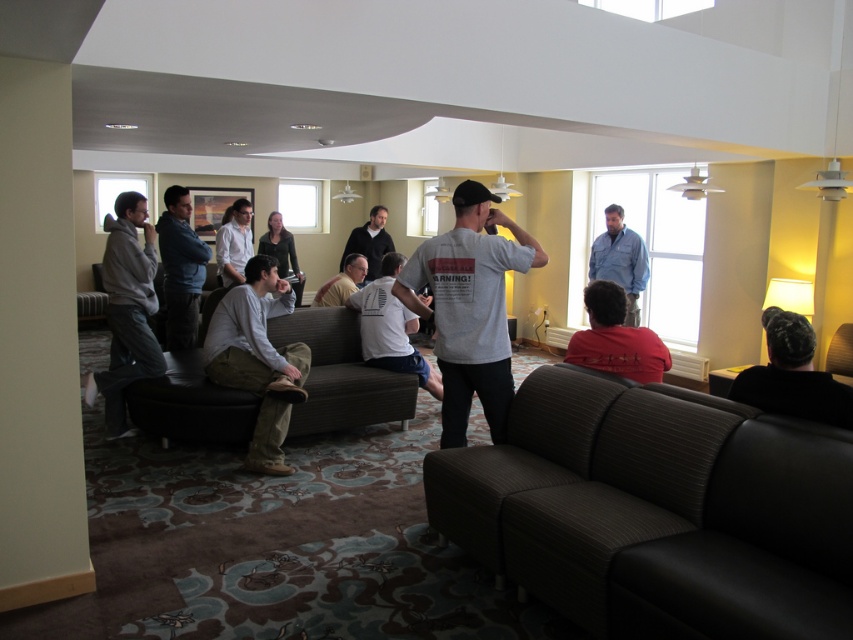
Question: Among these points, which one is nearest to the camera?

Choices:
 (A) tap(438, 236)
 (B) tap(282, 259)
 (C) tap(663, 346)

Answer: (A)

Question: Which object is farther from the camera taking this photo?

Choices:
 (A) white shirt at center
 (B) dark gray fabric couch at center

Answer: (A)

Question: In this image, where is gray hoodie at left located relative to light brown leather jacket at center?

Choices:
 (A) above
 (B) below

Answer: (B)

Question: Does white cotton t-shirt at center appear on the right side of denim shirt at upper right?

Choices:
 (A) yes
 (B) no

Answer: (B)

Question: Which point is farther to the camera?

Choices:
 (A) dark gray fabric couch at center
 (B) dark blue jeans at center
 (C) white cotton shirt at center

Answer: (B)

Question: Can you confirm if gray hoodie at left is positioned to the left of dark gray sweater at center?

Choices:
 (A) yes
 (B) no

Answer: (A)